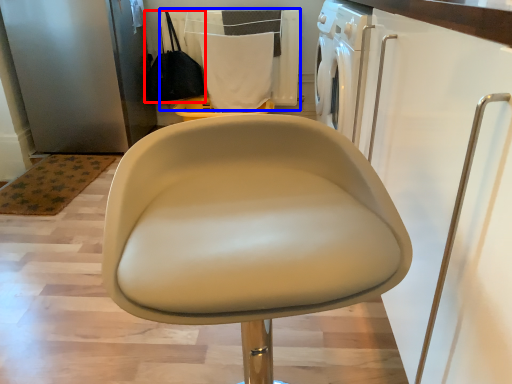
Question: Among these objects, which one is farthest to the camera, handbag (highlighted by a red box) or laundry (highlighted by a blue box)?

Choices:
 (A) handbag
 (B) laundry

Answer: (A)